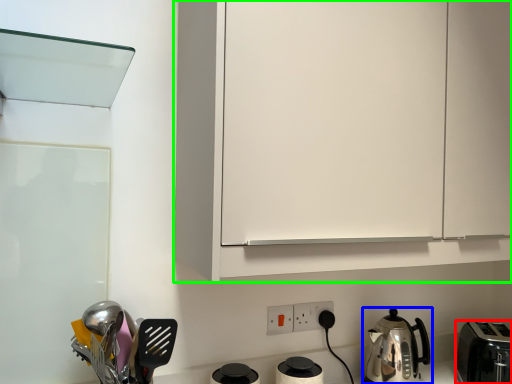
Question: Which object is the closest to the toaster (highlighted by a red box)? Choose among these: kitchen appliance (highlighted by a blue box) or cabinetry (highlighted by a green box).

Choices:
 (A) kitchen appliance
 (B) cabinetry

Answer: (A)